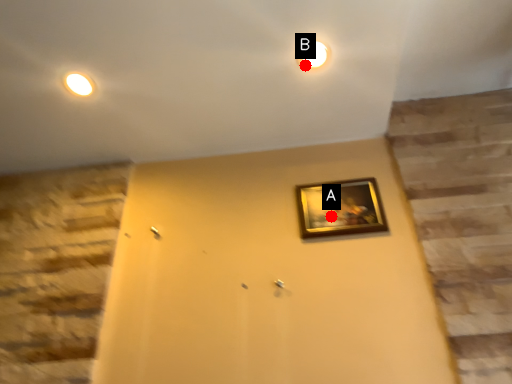
Question: Two points are circled on the image, labeled by A and B beside each circle. Which point is closer to the camera?

Choices:
 (A) A is closer
 (B) B is closer

Answer: (B)